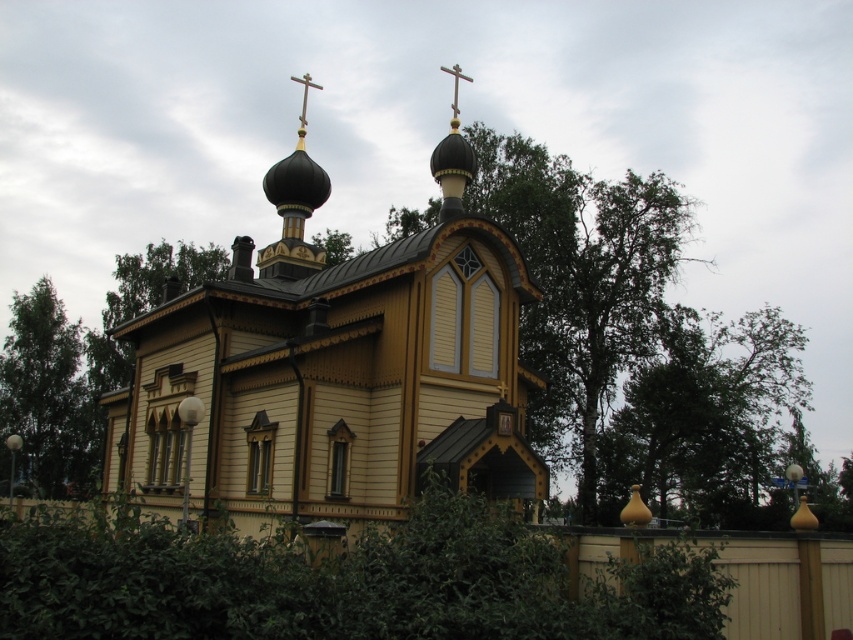
You are standing 10 meters away from the wooden church at center. You want to place a 15 meter long ladder to reach the metallic gold cross at upper center. Is the ladder long enough to reach the cross from the church?

The wooden church at center and metallic gold cross at upper center are 28.13 meters apart from each other. Since the ladder is only 15 meters long, it is not long enough to reach the cross from the church.

From the picture: You are standing in front of the church and want to take a photo that includes both the green leafy tree at left and the black wooden dome at center. What is the minimum distance you need to move backward to ensure both are in frame?

The green leafy tree at left is 231.82 feet away from the black wooden dome at center. To include both in your photo, you need to move back at least half of that distance, which is approximately 115.91 feet.